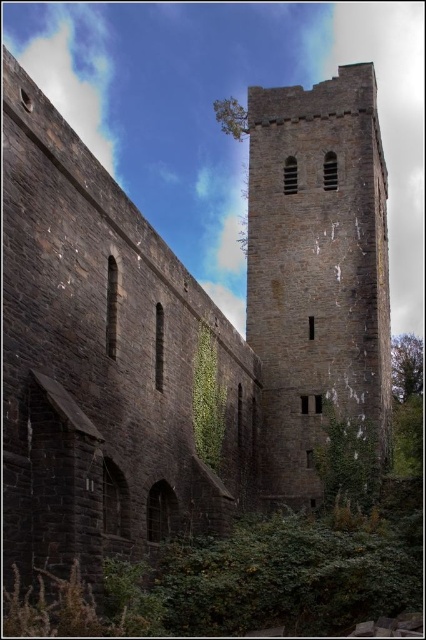
Question: Does green rough ivy at lower right lie in front of green leafy ivy at center?

Choices:
 (A) no
 (B) yes

Answer: (A)

Question: Which of these objects is positioned closest to the green rough ivy at lower right?

Choices:
 (A) green leafy ivy at center
 (B) dark gray stone tower at center

Answer: (B)

Question: Which object is farther from the camera taking this photo?

Choices:
 (A) green rough ivy at lower right
 (B) dark gray stone tower at center

Answer: (B)

Question: Which object is positioned closest to the dark gray stone tower at center?

Choices:
 (A) green rough ivy at lower right
 (B) green leafy ivy at center

Answer: (A)

Question: Is dark gray stone tower at center bigger than green leafy ivy at center?

Choices:
 (A) yes
 (B) no

Answer: (A)

Question: Does dark gray stone tower at center have a lesser width compared to green rough ivy at lower right?

Choices:
 (A) no
 (B) yes

Answer: (A)